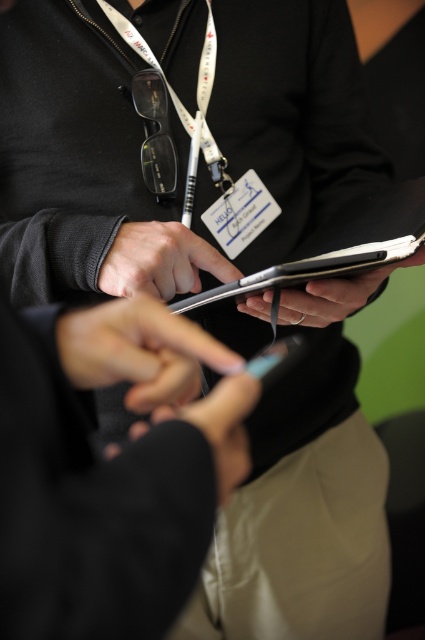
Question: Which point appears farthest from the camera in this image?

Choices:
 (A) (311, 314)
 (B) (98, 275)
 (C) (357, 216)
 (D) (207, 29)

Answer: (D)

Question: Which is farther from the satin black phone at center?

Choices:
 (A) matte black tablet at center
 (B) matte black pen at center
 (C) smooth black glove at center
 (D) white fabric lanyard at upper center

Answer: (D)

Question: Based on their relative distances, which object is farther from the smooth black glove at center?

Choices:
 (A) matte black clipboard at center
 (B) white fabric lanyard at upper center
 (C) matte black tablet at center
 (D) matte black pen at center

Answer: (B)

Question: From the image, what is the correct spatial relationship of satin black phone at center in relation to matte black tablet at center?

Choices:
 (A) left
 (B) right

Answer: (A)

Question: Is matte black pen at center wider than smooth black glove at center?

Choices:
 (A) yes
 (B) no

Answer: (A)

Question: Can you confirm if matte black pen at center is wider than white fabric lanyard at upper center?

Choices:
 (A) yes
 (B) no

Answer: (B)